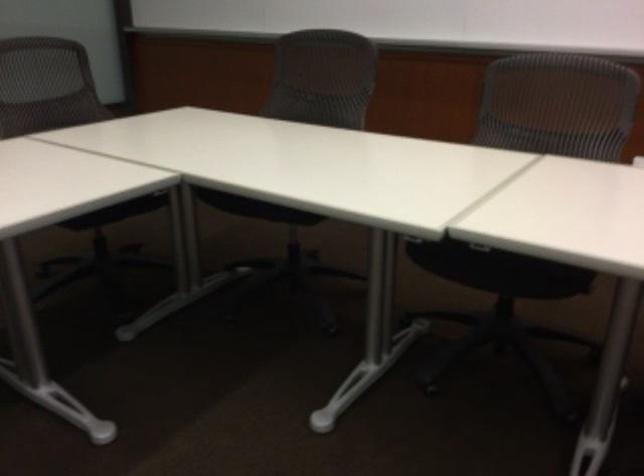
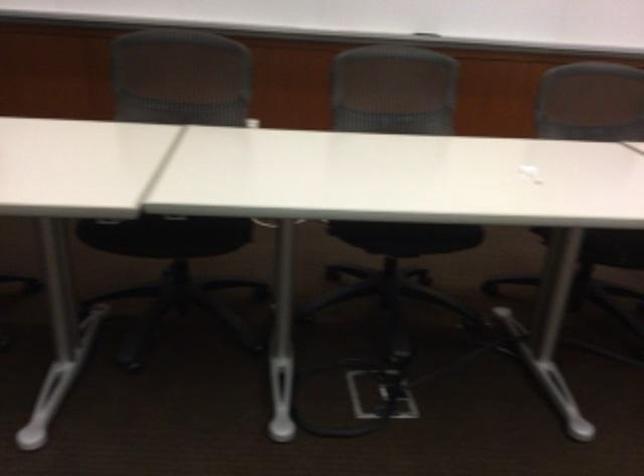
The point at (484, 268) is marked in the first image. Where is the corresponding point in the second image?

(166, 235)